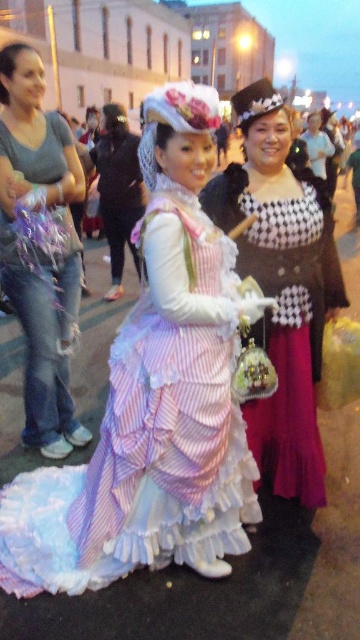
Who is positioned more to the left, checkered fabric dress at center or matte gray jeans at left?

matte gray jeans at left is more to the left.

Is point (325, 236) closer to viewer compared to point (39, 444)?

That is True.

Who is more distant from viewer, (x=317, y=305) or (x=2, y=273)?

Positioned behind is point (x=2, y=273).

Find the location of a particular element. checkered fabric dress at center is located at coordinates (281, 284).

Based on the photo, is pastel striped dress at center to the left of matte gray jeans at left from the viewer's perspective?

No, pastel striped dress at center is not to the left of matte gray jeans at left.

Who is more forward, (131, 532) or (15, 269)?

Point (131, 532) is in front.

Does point (119, 404) come closer to viewer compared to point (47, 154)?

Yes, it is in front of point (47, 154).

Locate an element on the screen. Image resolution: width=360 pixels, height=640 pixels. pastel striped dress at center is located at coordinates (154, 397).

Does pastel striped dress at center appear on the right side of checkered fabric dress at center?

In fact, pastel striped dress at center is to the left of checkered fabric dress at center.

Is the position of pastel striped dress at center more distant than that of checkered fabric dress at center?

No, pastel striped dress at center is in front of checkered fabric dress at center.

The image size is (360, 640). Describe the element at coordinates (154, 397) in the screenshot. I see `pastel striped dress at center` at that location.

Find the location of a particular element. pastel striped dress at center is located at coordinates (154, 397).